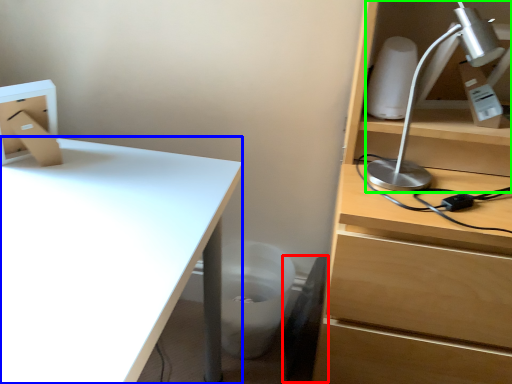
Question: Based on their relative distances, which object is farther from swivel chair (highlighted by a red box)? Choose from desk (highlighted by a blue box) and lamp (highlighted by a green box).

Choices:
 (A) desk
 (B) lamp

Answer: (A)